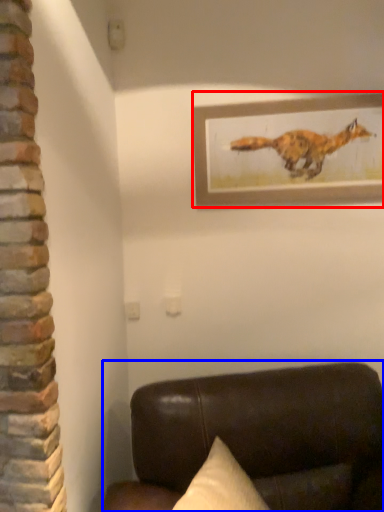
Question: Which object is closer to the camera taking this photo, picture frame (highlighted by a red box) or furniture (highlighted by a blue box)?

Choices:
 (A) picture frame
 (B) furniture

Answer: (B)